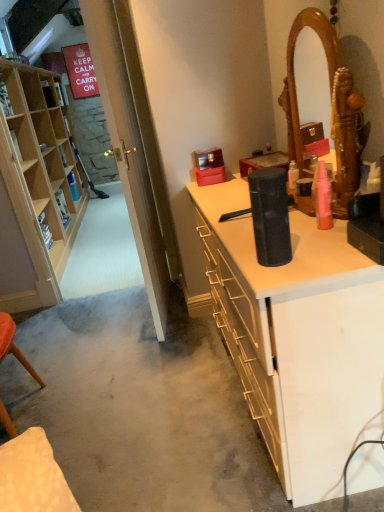
Find the location of a particular element. This screenshot has width=384, height=512. free space in front of transparent glass door at left is located at coordinates (157, 353).